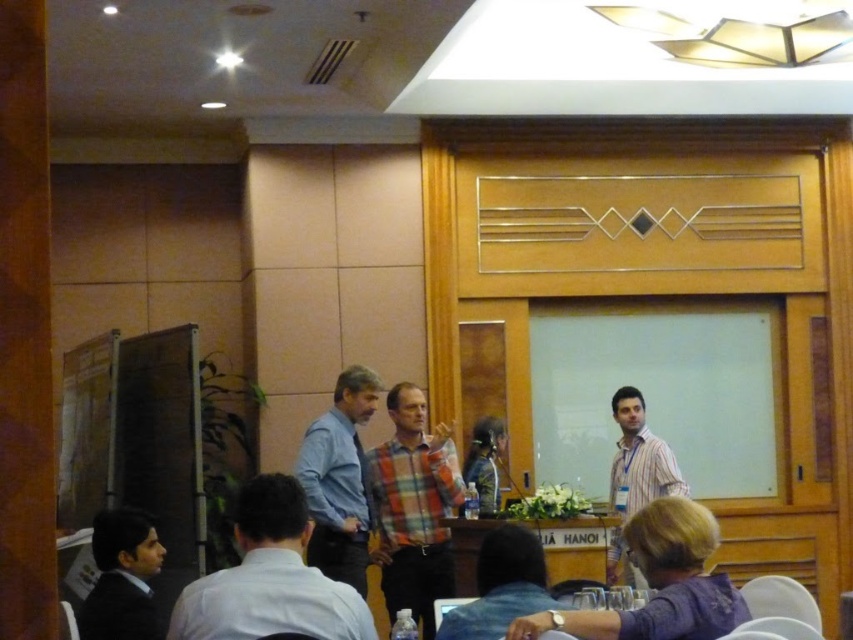
You are an event organizer who needs to arrange a microphone stand for the tallest person in the front. The microphone stand can be placed either behind the blue shirt at center or the wooden at center. Which one should you choose?

The blue shirt at center is taller than the wooden at center, so you should place the microphone stand behind the blue shirt at center to accommodate their height.

From the picture: You are an attendee sitting at the table and want to hand a document to the white shirt at center and the dark blue suit at lower left. Which one is closer to you?

The dark blue suit at lower left is closer to you since it is positioned lower and thus nearer than the white shirt at center which is higher up.

You are an attendee sitting at the table in the conference room. You notice two points marked on the floor near the front of the room. The first point is at coordinates point (195, 608) and the second point is at coordinates point (125, 584). Which point is closer to you as you sit at your table?

Point (195, 608) is closer to you because it is in front of point (125, 584), meaning it is nearer to your position at the table.